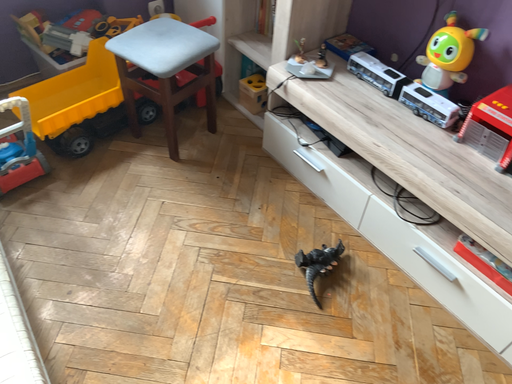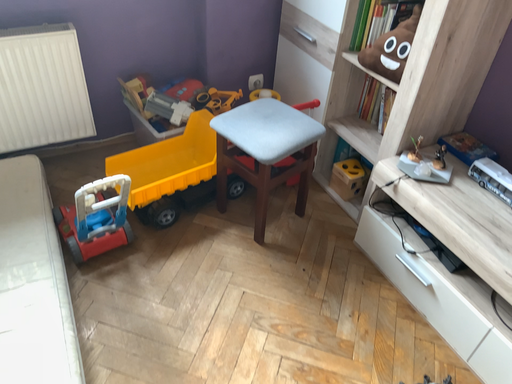
Question: How did the camera likely rotate when shooting the video?

Choices:
 (A) rotated upward
 (B) rotated downward

Answer: (A)